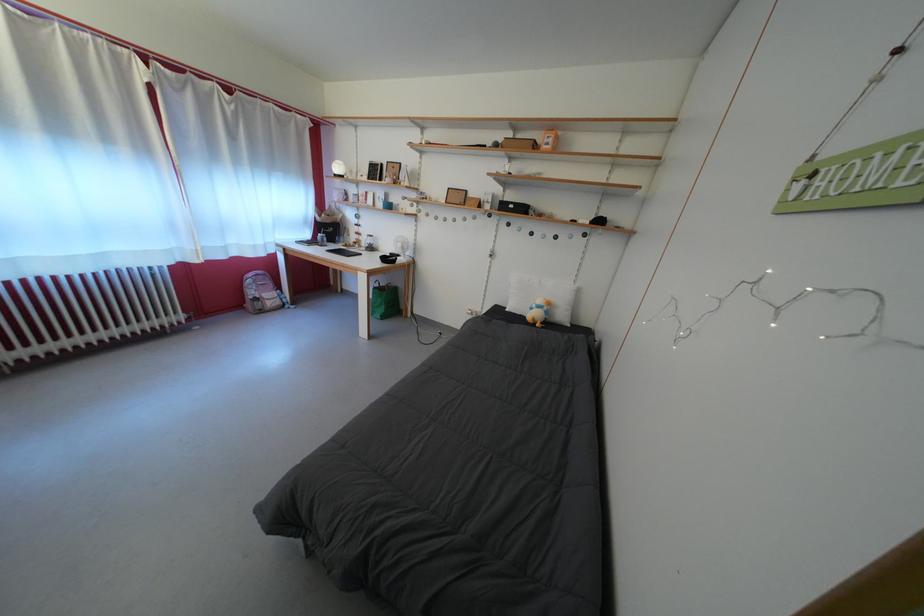
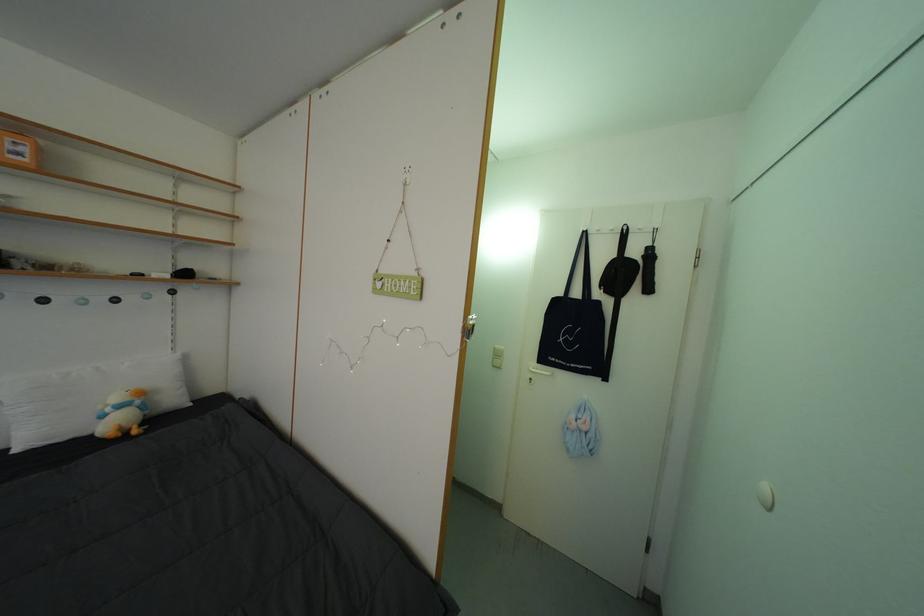
The point at (554,318) is marked in the first image. Where is the corresponding point in the second image?

(152, 413)